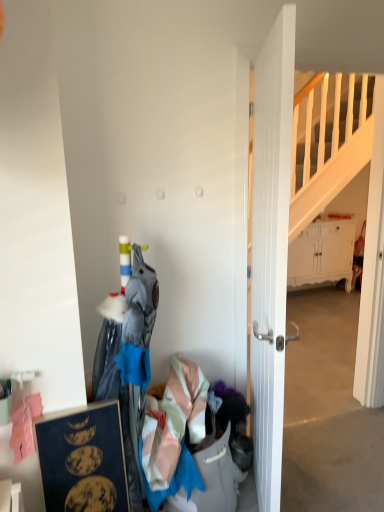
Question: In the image, is white wooden door at center positioned in front of or behind white matte cabinet at right?

Choices:
 (A) behind
 (B) front

Answer: (B)

Question: Looking at the image, does white wooden door at center seem bigger or smaller compared to white matte cabinet at right?

Choices:
 (A) big
 (B) small

Answer: (B)

Question: Which is nearer to the white wooden door at center?

Choices:
 (A) light pink satin dress at lower center
 (B) dark blue matte picture frame at lower left
 (C) white matte cabinet at right

Answer: (A)

Question: Based on their relative distances, which object is farther from the white matte cabinet at right?

Choices:
 (A) light pink satin dress at lower center
 (B) dark blue matte picture frame at lower left
 (C) white wooden door at center

Answer: (B)